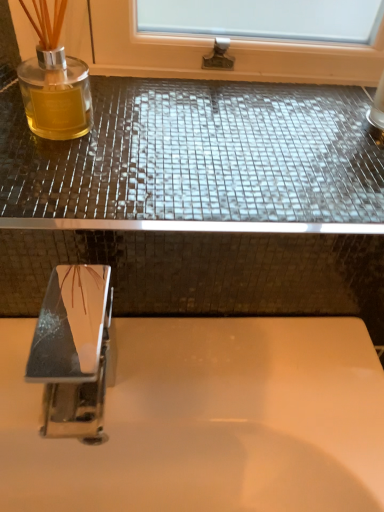
Question: Is white glossy sink at center turned away from shiny mosaic tile counter top at upper center?

Choices:
 (A) yes
 (B) no

Answer: (B)

Question: Is white glossy sink at center not near shiny mosaic tile counter top at upper center?

Choices:
 (A) no
 (B) yes

Answer: (A)

Question: From the image's perspective, would you say white glossy sink at center is shown under shiny mosaic tile counter top at upper center?

Choices:
 (A) yes
 (B) no

Answer: (A)

Question: From a real-world perspective, does white glossy sink at center sit lower than shiny mosaic tile counter top at upper center?

Choices:
 (A) no
 (B) yes

Answer: (B)

Question: Can you confirm if white glossy sink at center is thinner than shiny mosaic tile counter top at upper center?

Choices:
 (A) yes
 (B) no

Answer: (A)

Question: Is point (188, 108) positioned closer to the camera than point (51, 406)?

Choices:
 (A) farther
 (B) closer

Answer: (A)

Question: Considering their positions, is shiny mosaic tile counter top at upper center located in front of or behind polished chrome tap at lower left?

Choices:
 (A) front
 (B) behind

Answer: (B)

Question: Is shiny mosaic tile counter top at upper center to the left or to the right of polished chrome tap at lower left in the image?

Choices:
 (A) right
 (B) left

Answer: (A)

Question: From the image's perspective, relative to polished chrome tap at lower left, is shiny mosaic tile counter top at upper center above or below?

Choices:
 (A) above
 (B) below

Answer: (A)

Question: From the image's perspective, is white glossy sink at center positioned above or below shiny mosaic tile counter top at upper center?

Choices:
 (A) below
 (B) above

Answer: (A)

Question: Based on their positions, is white glossy sink at center located to the left or right of shiny mosaic tile counter top at upper center?

Choices:
 (A) right
 (B) left

Answer: (B)

Question: Considering the positions of white glossy sink at center and shiny mosaic tile counter top at upper center in the image, is white glossy sink at center bigger or smaller than shiny mosaic tile counter top at upper center?

Choices:
 (A) small
 (B) big

Answer: (B)

Question: Considering the positions of white glossy sink at center and shiny mosaic tile counter top at upper center in the image, is white glossy sink at center wider or thinner than shiny mosaic tile counter top at upper center?

Choices:
 (A) thin
 (B) wide

Answer: (A)

Question: From the image's perspective, relative to polished chrome tap at lower left, is white glossy sink at center above or below?

Choices:
 (A) below
 (B) above

Answer: (A)

Question: Considering their positions, is white glossy sink at center located in front of or behind polished chrome tap at lower left?

Choices:
 (A) front
 (B) behind

Answer: (B)